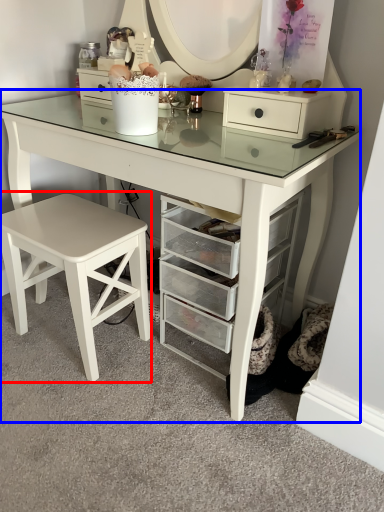
Question: Which point is closer to the camera, stool (highlighted by a red box) or table (highlighted by a blue box)?

Choices:
 (A) stool
 (B) table

Answer: (B)